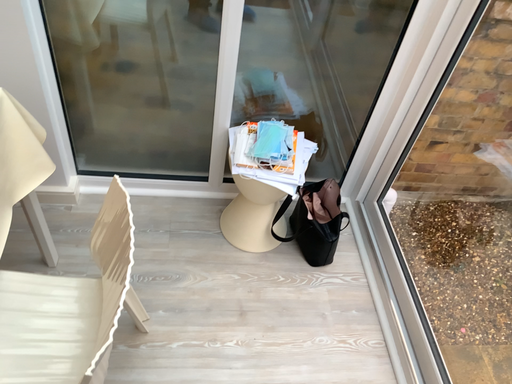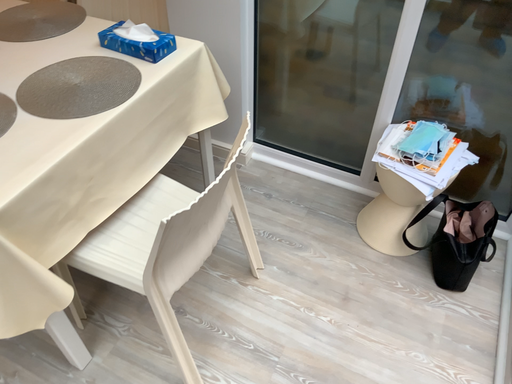
Question: Which way did the camera rotate in the video?

Choices:
 (A) rotated left
 (B) rotated right

Answer: (A)